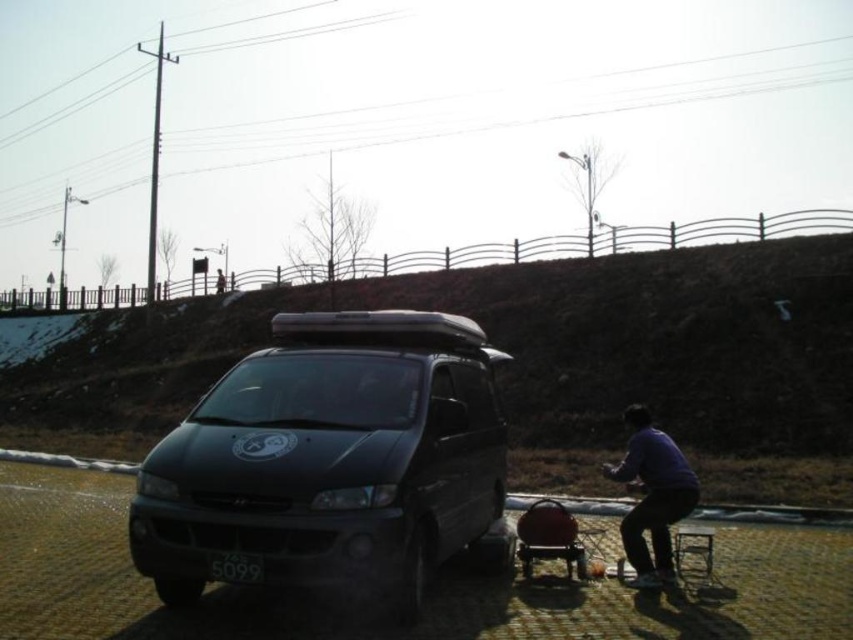
Question: Which point is closer to the camera?

Choices:
 (A) purple matte shirt at lower right
 (B) matte black van at center

Answer: (B)

Question: Is matte black van at center further to the viewer compared to purple matte shirt at lower right?

Choices:
 (A) no
 (B) yes

Answer: (A)

Question: Can you confirm if purple matte shirt at lower right is bigger than black plastic license plate at center?

Choices:
 (A) yes
 (B) no

Answer: (A)

Question: Is purple matte shirt at lower right to the right of black plastic license plate at center from the viewer's perspective?

Choices:
 (A) no
 (B) yes

Answer: (B)

Question: Which point is farther to the camera?

Choices:
 (A) (166, 564)
 (B) (653, 563)
 (C) (235, 576)

Answer: (B)

Question: Based on their relative distances, which object is farther from the matte black van at center?

Choices:
 (A) purple matte shirt at lower right
 (B) black plastic license plate at center

Answer: (A)